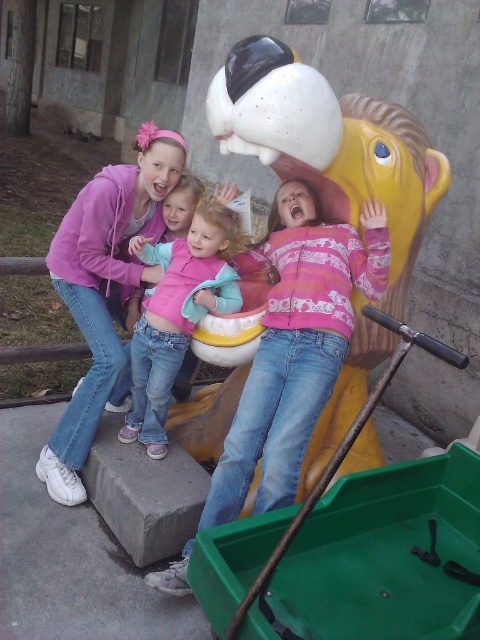
You are a parent looking for your child wearing a pink hoodie and a pink fleece jacket. You see the matte pink hoodie at center and the pink fleece jacket at upper center. Which clothing item is taller?

The matte pink hoodie at center is much taller than the pink fleece jacket at upper center.

You are standing at the playground and want to know which of the two points, point (x=233, y=488) or point (x=72, y=442), is closer to you. Can you determine this based on the scene?

Point (x=233, y=488) is closer to the viewer than point (x=72, y=442).